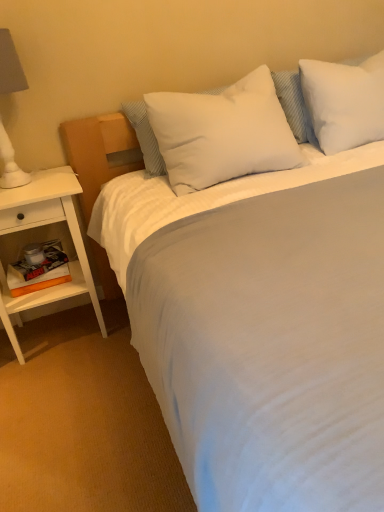
You are a GUI agent. You are given a task and a screenshot of the screen. Output one action in this format:
    pyautogui.click(x=<x>, y=<y>)
    Task: Click on the vacant region above orange matte book at left (from a real-world perspective)
    
    Given the screenshot: What is the action you would take?
    pyautogui.click(x=29, y=272)